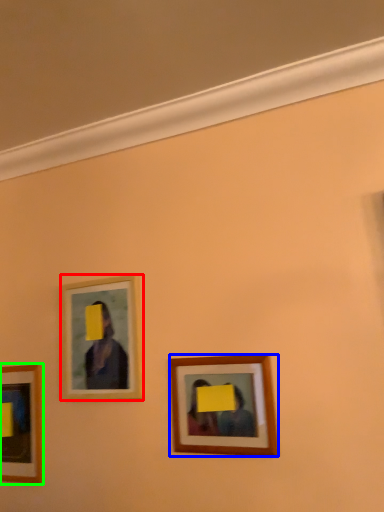
Question: Which object is the closest to the picture frame (highlighted by a red box)? Choose among these: picture frame (highlighted by a blue box) or picture frame (highlighted by a green box).

Choices:
 (A) picture frame
 (B) picture frame

Answer: (B)